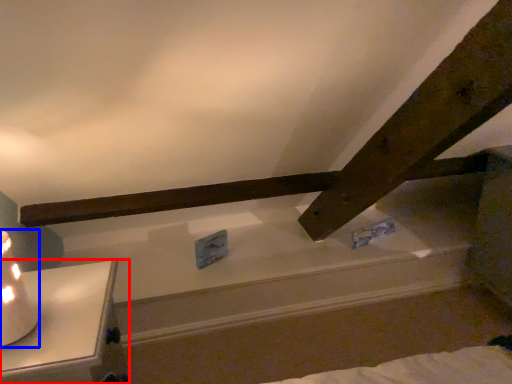
Question: Among these objects, which one is farthest to the camera, furniture (highlighted by a red box) or table lamp (highlighted by a blue box)?

Choices:
 (A) furniture
 (B) table lamp

Answer: (A)